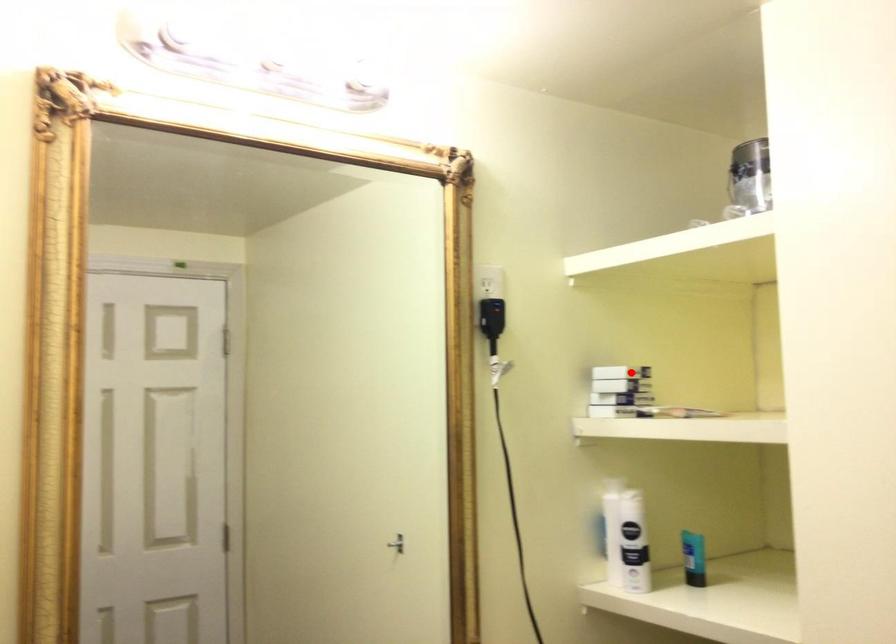
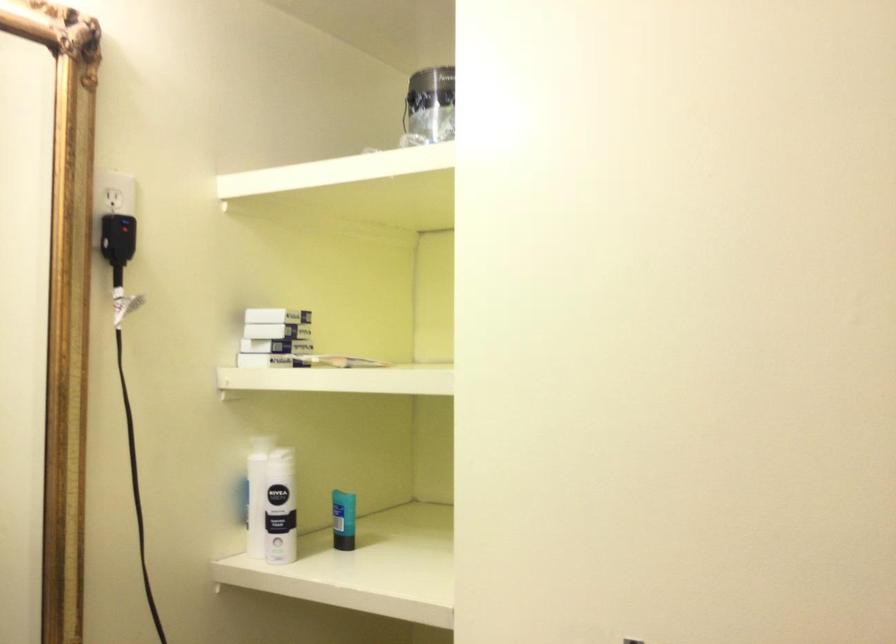
Question: I am providing you with two images of the same scene from different viewpoints. A red point is shown in image1. For the corresponding object point in image2, is it positioned nearer or farther from the camera?

Choices:
 (A) Nearer
 (B) Farther

Answer: (A)